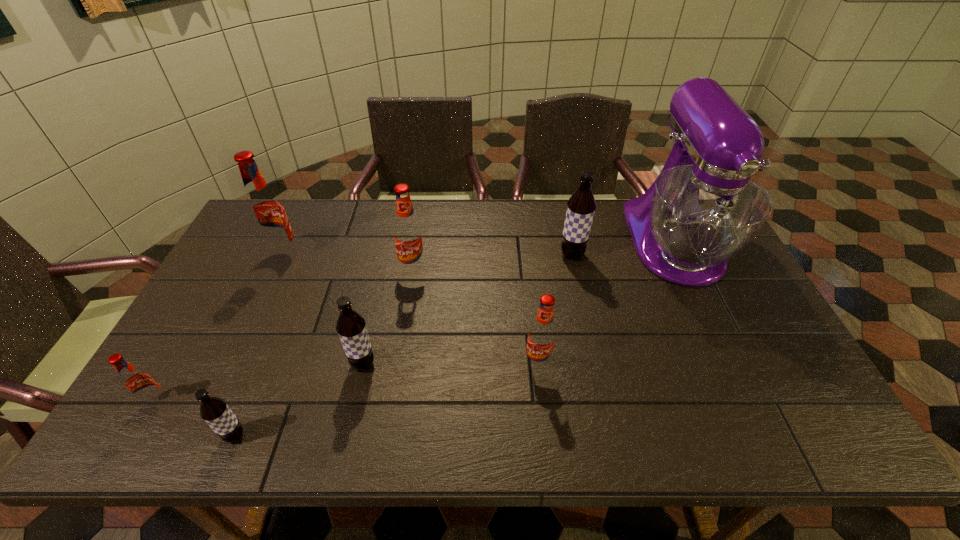
At what (x,y) coordinates should I click in order to perform the action: click on vacant point located between the fourth object from right to left and the fifth root beer from right to left. Please return your answer as a coordinate pair (x, y). This screenshot has width=960, height=540. Looking at the image, I should click on [324, 353].

Where is `object that is the fifth closest to the fifth object from left to right`? object that is the fifth closest to the fifth object from left to right is located at coordinates (214, 411).

Locate which object is the second closest to the purple mixer. Please provide its 2D coordinates. Your answer should be formatted as a tuple, i.e. [(x, y)], where the tuple contains the x and y coordinates of a point satisfying the conditions above.

[(542, 333)]

Identify which root beer is the fourth closest to the seventh object from right to left. Please provide its 2D coordinates. Your answer should be formatted as a tuple, i.e. [(x, y)], where the tuple contains the x and y coordinates of a point satisfying the conditions above.

[(214, 411)]

Locate an element on the screen. The image size is (960, 540). root beer that is the fifth closest to the second root beer from left to right is located at coordinates (542, 333).

Locate which red root beer is the fourth closest to the second object from right to left. Please provide its 2D coordinates. Your answer should be formatted as a tuple, i.e. [(x, y)], where the tuple contains the x and y coordinates of a point satisfying the conditions above.

[(138, 383)]

Select which red root beer appears as the closest to the second red root beer from right to left. Please provide its 2D coordinates. Your answer should be formatted as a tuple, i.e. [(x, y)], where the tuple contains the x and y coordinates of a point satisfying the conditions above.

[(265, 210)]

Locate which brown root beer ranks second in proximity to the nearest red root beer. Please provide its 2D coordinates. Your answer should be formatted as a tuple, i.e. [(x, y)], where the tuple contains the x and y coordinates of a point satisfying the conditions above.

[(351, 327)]

Point out which brown root beer is positioned as the third nearest to the third farthest red root beer. Please provide its 2D coordinates. Your answer should be formatted as a tuple, i.e. [(x, y)], where the tuple contains the x and y coordinates of a point satisfying the conditions above.

[(214, 411)]